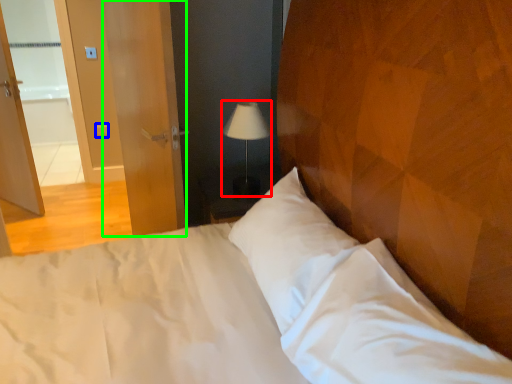
Question: Based on their relative distances, which object is farther from lamp (highlighted by a red box)? Choose from light switch (highlighted by a blue box) and screen door (highlighted by a green box).

Choices:
 (A) light switch
 (B) screen door

Answer: (A)